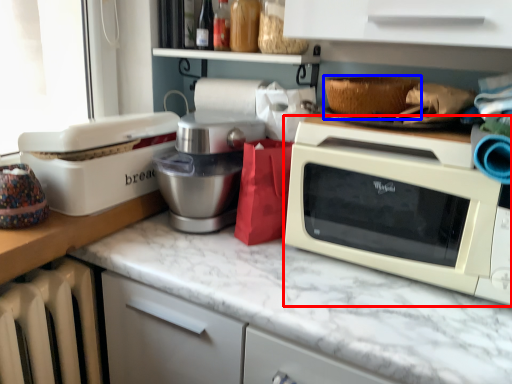
Question: Among these objects, which one is farthest to the camera, microwave oven (highlighted by a red box) or basket (highlighted by a blue box)?

Choices:
 (A) microwave oven
 (B) basket

Answer: (B)